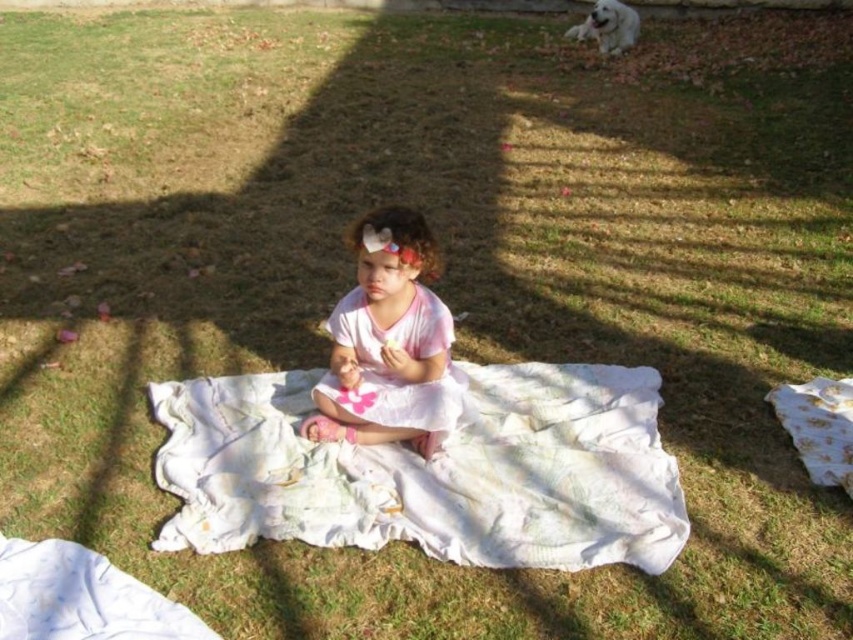
Is white textured blanket at center further to camera compared to pink satin dress at center?

No, it is in front of pink satin dress at center.

Can you confirm if white textured blanket at center is wider than pink satin dress at center?

Yes, white textured blanket at center is wider than pink satin dress at center.

Image resolution: width=853 pixels, height=640 pixels. Describe the element at coordinates (431, 470) in the screenshot. I see `white textured blanket at center` at that location.

I want to click on white textured blanket at center, so click(431, 470).